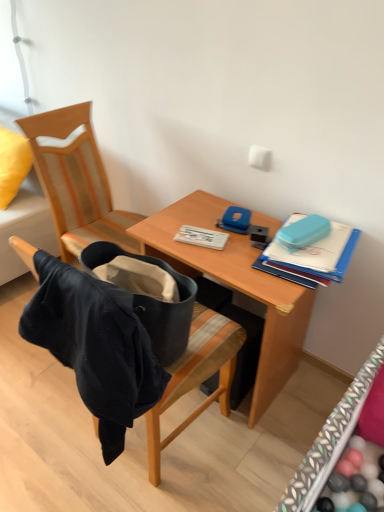
This screenshot has width=384, height=512. Identify the location of free point to the left of teal plastic case at upper right. (232, 247).